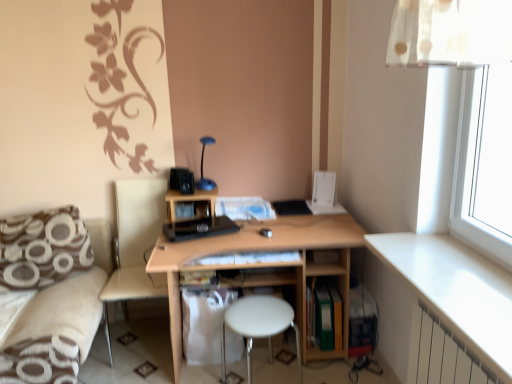
Question: In terms of height, does white plastic stool at center look taller or shorter compared to white glossy table at lower right?

Choices:
 (A) tall
 (B) short

Answer: (A)

Question: Is white plastic stool at center spatially inside white glossy table at lower right, or outside of it?

Choices:
 (A) inside
 (B) outside

Answer: (B)

Question: Based on their relative distances, which object is nearer to the white plastic stool at center?

Choices:
 (A) white paper at center, the 3th book positioned from the right
 (B) beige fabric swivel chair at lower left
 (C) light brown wooden desk at center
 (D) white metallic radiator at lower right
 (E) green matte folder at lower center, which ranks as the 3th book in top-to-bottom order

Answer: (C)

Question: Based on their relative distances, which object is farther from the white glossy table at lower right?

Choices:
 (A) matte plastic book at center, arranged as the 1th book when viewed from the left
 (B) light brown wooden desk at center
 (C) white metallic radiator at lower right
 (D) beige fabric swivel chair at lower left
 (E) brown printed fabric pillow at lower left

Answer: (E)